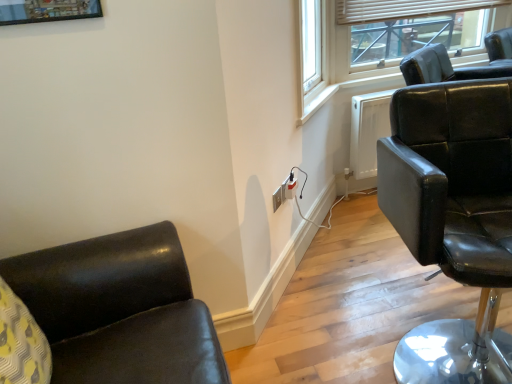
Question: Considering their positions, is matte black socket at lower right, the 1th electric outlet positioned from the back, located in front of or behind matte black chair at upper right?

Choices:
 (A) front
 (B) behind

Answer: (A)

Question: Is point (286, 193) positioned closer to the camera than point (381, 48)?

Choices:
 (A) closer
 (B) farther

Answer: (A)

Question: Which of these objects is positioned closest to the matte black chair at right?

Choices:
 (A) white plastic outlet at center, the second electric outlet viewed from the back
 (B) matte black socket at lower right, the 2th electric outlet viewed from the front
 (C) matte black chair at upper right

Answer: (A)

Question: Which is farther from the matte black chair at right?

Choices:
 (A) white plastic outlet at center, the second electric outlet viewed from the back
 (B) matte black socket at lower right, the 2th electric outlet viewed from the front
 (C) matte black chair at upper right

Answer: (C)